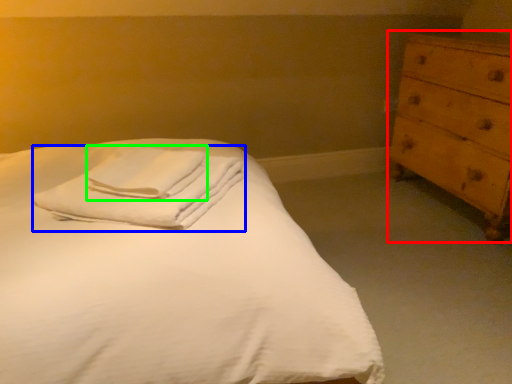
Question: Which object is positioned farthest from chest of drawers (highlighted by a red box)? Select from material (highlighted by a blue box) and bath towel (highlighted by a green box).

Choices:
 (A) material
 (B) bath towel

Answer: (B)